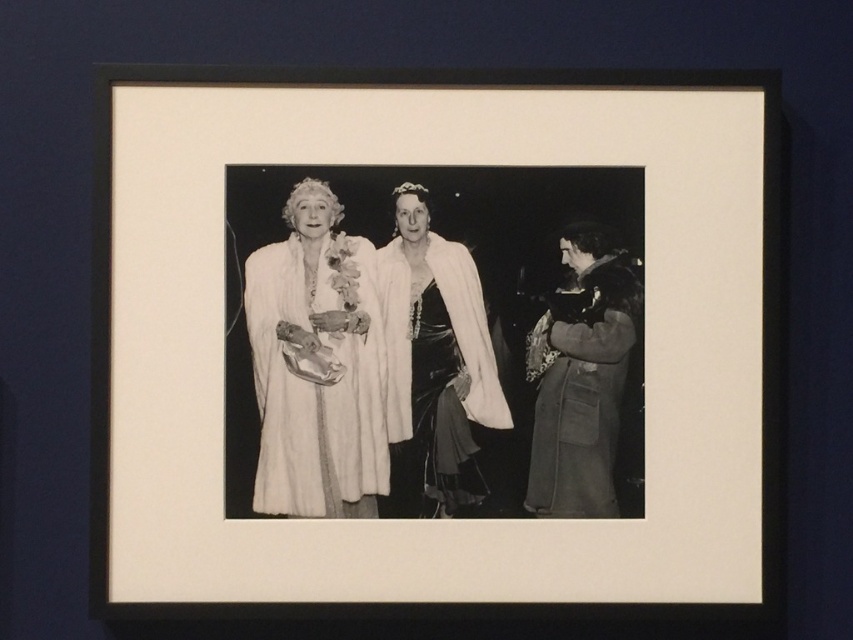
Consider the image. You are an art conservator examining the framed black and white photograph on the dark blue wall. You notice two points marked in the image at coordinates point (318, 472) and point (589, 236). Which of these points is nearer to your viewpoint as you look at the photograph?

Point (318, 472) is closer to the camera than point (589, 236), so the point at (318, 472) is nearer to your viewpoint.